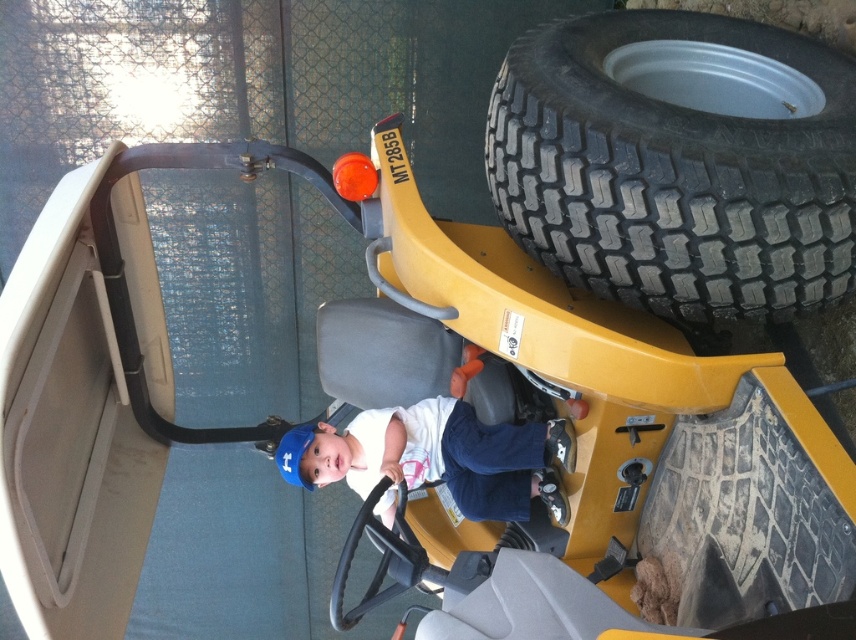
You are a safety inspector checking the distance between the black rubber tire at right and the white fabric shirt at center. According to safety regulations, the minimum safe distance between a child and a moving part like a tire should be at least 40 inches. Is the current distance compliant with the safety standards?

The black rubber tire at right is 38.40 inches away from the white fabric shirt at center. Since the required minimum distance is 40 inches, the current distance is 1.6 inches too short, so it does not comply with safety standards.